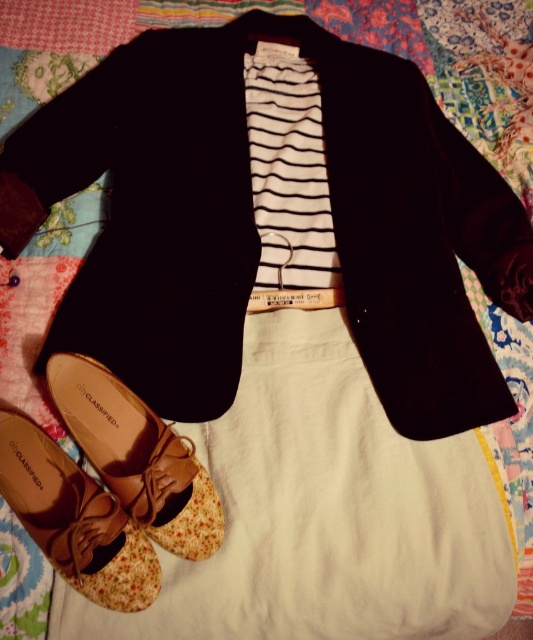
Is black cotton jacket at center smaller than brown fabric shoe at lower left?

No, black cotton jacket at center is not smaller than brown fabric shoe at lower left.

Is black cotton jacket at center shorter than brown fabric shoe at lower left?

In fact, black cotton jacket at center may be taller than brown fabric shoe at lower left.

Is point (464, 352) positioned after point (31, 435)?

Yes, it is.

Find the location of a particular element. The image size is (533, 640). black cotton jacket at center is located at coordinates (256, 225).

Does black cotton jacket at center have a lesser height compared to brown leather shoe at lower left?

No, black cotton jacket at center is not shorter than brown leather shoe at lower left.

I want to click on black cotton jacket at center, so click(256, 225).

Find the location of a particular element. This screenshot has height=640, width=533. black cotton jacket at center is located at coordinates (256, 225).

Does point (93, 449) come closer to viewer compared to point (36, 433)?

Yes, it is.

Is brown leather shoe at lower left bigger than brown fabric shoe at lower left?

Indeed, brown leather shoe at lower left has a larger size compared to brown fabric shoe at lower left.

Identify the location of brown leather shoe at lower left. The image size is (533, 640). (138, 456).